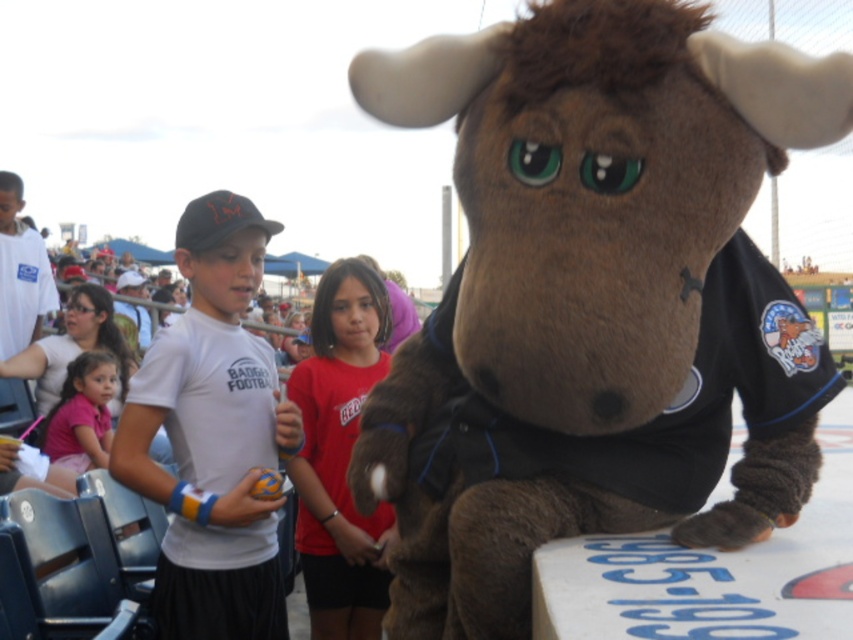
You are a photographer standing at the center of the field. You want to take a photo that includes both the brown plush moose at center and the pink fabric shirt at lower left. Given that your camera has a maximum zoom range of 10 meters, can you capture both subjects in a single frame without moving?

The brown plush moose at center and the pink fabric shirt at lower left are 4.22 meters apart from each other. Since the distance between them is within the camera maximum zoom range of 10 meters, yes, you can capture both subjects in a single frame without moving.